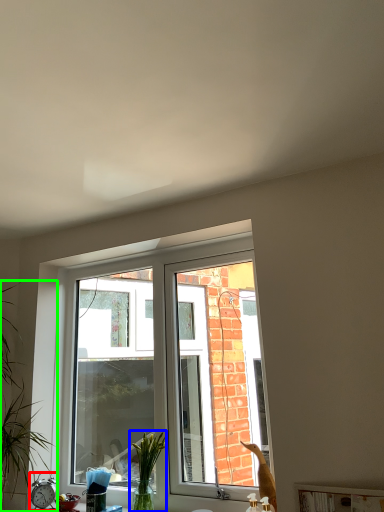
Question: Which object is positioned closest to alarm clock (highlighted by a red box)? Select from plant (highlighted by a blue box) and houseplant (highlighted by a green box).

Choices:
 (A) plant
 (B) houseplant

Answer: (B)